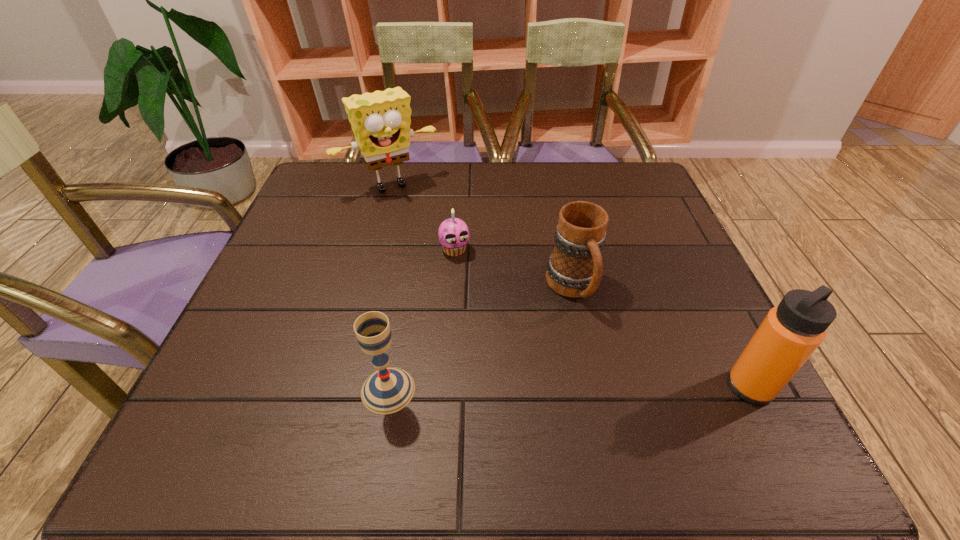
The height and width of the screenshot is (540, 960). What are the coordinates of `object that can be found as the closest to the mug` in the screenshot? It's located at (453, 233).

This screenshot has width=960, height=540. What are the coordinates of `object that is the third closest to the second object from right to left` in the screenshot? It's located at (388, 390).

The width and height of the screenshot is (960, 540). What are the coordinates of `vacant region that satisfies the following two spatial constraints: 1. on the front side of the farthest object; 2. on the right side of the chalice` in the screenshot? It's located at (335, 390).

Identify the location of blank space that satisfies the following two spatial constraints: 1. on the back side of the chalice; 2. on the right side of the cupcake. (412, 250).

This screenshot has width=960, height=540. What are the coordinates of `vacant area that satisfies the following two spatial constraints: 1. on the back side of the second farthest object; 2. on the right side of the chalice` in the screenshot? It's located at (412, 250).